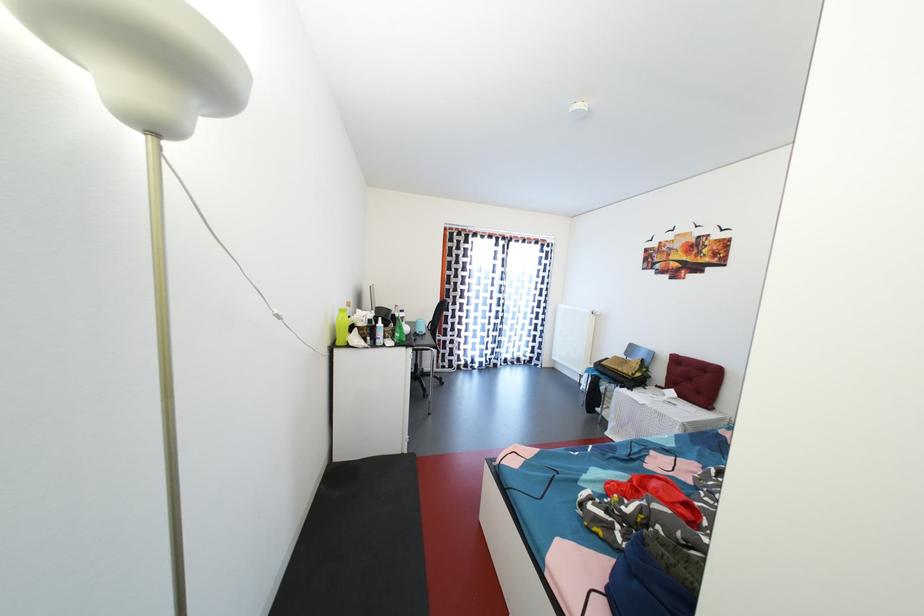
This screenshot has width=924, height=616. In order to click on white dispenser pump in this screenshot , I will do `click(379, 321)`.